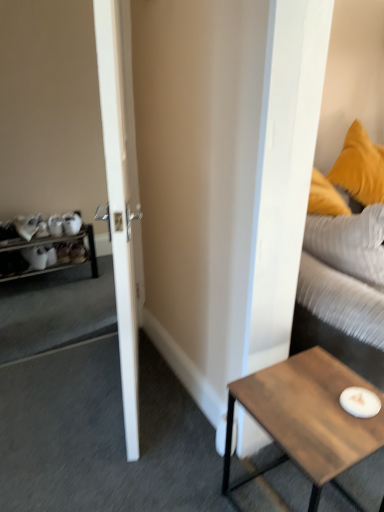
Measure the distance between velvet yellow pillow at upper right and camera.

The depth of velvet yellow pillow at upper right is 4.50 feet.

What do you see at coordinates (306, 419) in the screenshot? This screenshot has width=384, height=512. I see `wooden coffee table at lower right` at bounding box center [306, 419].

The height and width of the screenshot is (512, 384). What do you see at coordinates (47, 254) in the screenshot?
I see `wooden shelf at left` at bounding box center [47, 254].

What are the coordinates of `velvet yellow pillow at upper right` in the screenshot? It's located at (344, 290).

Are velvet yellow pillow at upper right and wooden coffee table at lower right far apart?

velvet yellow pillow at upper right is near wooden coffee table at lower right, not far away.

In terms of width, does velvet yellow pillow at upper right look wider or thinner when compared to wooden coffee table at lower right?

Considering their sizes, velvet yellow pillow at upper right looks slimmer than wooden coffee table at lower right.

Between velvet yellow pillow at upper right and wooden coffee table at lower right, which one is positioned in front?

wooden coffee table at lower right is in front.

Could you tell me if velvet yellow pillow at upper right is turned towards wooden coffee table at lower right?

No, velvet yellow pillow at upper right is not oriented towards wooden coffee table at lower right.

Who is shorter, wooden shelf at left or wooden coffee table at lower right?

wooden shelf at left is shorter.

Does wooden shelf at left have a lesser width compared to wooden coffee table at lower right?

Yes.

Choose the correct answer: Is wooden shelf at left inside wooden coffee table at lower right or outside it?

The correct answer is: outside.

Is the position of wooden shelf at left more distant than that of wooden coffee table at lower right?

Yes, wooden shelf at left is further from the viewer.

Is wooden shelf at left taller or shorter than white glossy door at left?

wooden shelf at left is shorter than white glossy door at left.

Based on the photo, does wooden shelf at left contain white glossy door at left?

That's incorrect, white glossy door at left is not inside wooden shelf at left.

Does point (11, 276) appear closer or farther from the camera than point (128, 399)?

Point (11, 276) appears to be farther away from the viewer than point (128, 399).

Could you tell me if wooden shelf at left is turned towards white glossy door at left?

Yes, wooden shelf at left is oriented towards white glossy door at left.

Can you confirm if wooden shelf at left is positioned to the left of velvet yellow pillow at upper right?

Yes.

The width and height of the screenshot is (384, 512). I want to click on shelf that is behind the velvet yellow pillow at upper right, so click(47, 254).

Consider the image. In terms of height, does wooden shelf at left look taller or shorter compared to velvet yellow pillow at upper right?

wooden shelf at left is shorter than velvet yellow pillow at upper right.

Which is more distant, (64, 250) or (316, 253)?

Positioned behind is point (64, 250).

Image resolution: width=384 pixels, height=512 pixels. I want to click on studio couch in front of the wooden shelf at left, so click(344, 290).

Is velvet yellow pillow at upper right facing towards wooden shelf at left?

No, velvet yellow pillow at upper right does not turn towards wooden shelf at left.

From a real-world perspective, is velvet yellow pillow at upper right above or below wooden shelf at left?

In terms of real-world spatial position, velvet yellow pillow at upper right is above wooden shelf at left.

Does point (350, 293) appear closer or farther from the camera than point (50, 254)?

Clearly, point (350, 293) is closer to the camera than point (50, 254).

Is white glossy door at left at the back of wooden coffee table at lower right?

Correct, wooden coffee table at lower right is looking away from white glossy door at left.

How much distance is there between wooden coffee table at lower right and white glossy door at left?

wooden coffee table at lower right and white glossy door at left are 23.58 inches apart from each other.

Considering the sizes of wooden coffee table at lower right and white glossy door at left in the image, is wooden coffee table at lower right wider or thinner than white glossy door at left?

wooden coffee table at lower right is wider than white glossy door at left.

Is wooden coffee table at lower right not close to white glossy door at left?

No, wooden coffee table at lower right is in close proximity to white glossy door at left.

Is white glossy door at left located within velvet yellow pillow at upper right?

No.

How much distance is there between velvet yellow pillow at upper right and white glossy door at left?

The distance of velvet yellow pillow at upper right from white glossy door at left is 28.85 inches.

Which of these two, velvet yellow pillow at upper right or white glossy door at left, is wider?

Wider between the two is velvet yellow pillow at upper right.

Where is `coffee table on the left of velvet yellow pillow at upper right`? This screenshot has height=512, width=384. coffee table on the left of velvet yellow pillow at upper right is located at coordinates (306, 419).

Where is `coffee table in front of the wooden shelf at left`? coffee table in front of the wooden shelf at left is located at coordinates (306, 419).

From the image, which object appears to be nearer to velvet yellow pillow at upper right, wooden shelf at left or wooden coffee table at lower right?

Based on the image, wooden coffee table at lower right appears to be nearer to velvet yellow pillow at upper right.

In the scene shown: Looking at the image, which one is located further to white glossy door at left, wooden shelf at left or wooden coffee table at lower right?

wooden shelf at left.

Which object lies further to the anchor point wooden shelf at left, velvet yellow pillow at upper right or wooden coffee table at lower right?

wooden coffee table at lower right is positioned further to the anchor wooden shelf at left.

Estimate the real-world distances between objects in this image. Which object is closer to velvet yellow pillow at upper right, wooden coffee table at lower right or wooden shelf at left?

wooden coffee table at lower right lies closer to velvet yellow pillow at upper right than the other object.

Based on their spatial positions, is wooden shelf at left or velvet yellow pillow at upper right further from white glossy door at left?

wooden shelf at left is positioned further to the anchor white glossy door at left.

Which object lies nearer to the anchor point white glossy door at left, wooden coffee table at lower right or velvet yellow pillow at upper right?

wooden coffee table at lower right is closer to white glossy door at left.

From the image, which object appears to be nearer to velvet yellow pillow at upper right, white glossy door at left or wooden coffee table at lower right?

wooden coffee table at lower right lies closer to velvet yellow pillow at upper right than the other object.

Estimate the real-world distances between objects in this image. Which object is further from white glossy door at left, velvet yellow pillow at upper right or wooden coffee table at lower right?

velvet yellow pillow at upper right is positioned further to the anchor white glossy door at left.

The image size is (384, 512). What are the coordinates of `coffee table between white glossy door at left and wooden shelf at left from front to back` in the screenshot? It's located at (306, 419).

You are a GUI agent. You are given a task and a screenshot of the screen. Output one action in this format:
    pyautogui.click(x=<x>, y=<y>)
    Task: Click on the coffee table between wooden shelf at left and velvet yellow pillow at upper right in the horizontal direction
    This screenshot has width=384, height=512.
    Given the screenshot: What is the action you would take?
    tap(306, 419)

You are a GUI agent. You are given a task and a screenshot of the screen. Output one action in this format:
    pyautogui.click(x=<x>, y=<y>)
    Task: Click on the door between wooden shelf at left and velvet yellow pillow at upper right from left to right
    
    Given the screenshot: What is the action you would take?
    pyautogui.click(x=121, y=193)

Identify the location of coffee table between white glossy door at left and velvet yellow pillow at upper right in the horizontal direction. (306, 419).